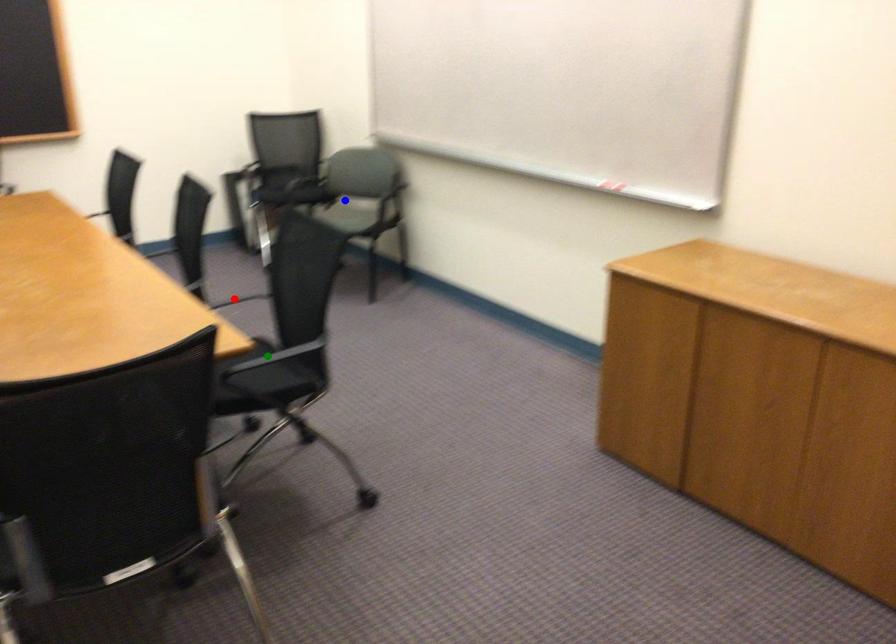
Order these from nearest to farthest:
A) red point
B) green point
C) blue point

green point < red point < blue point